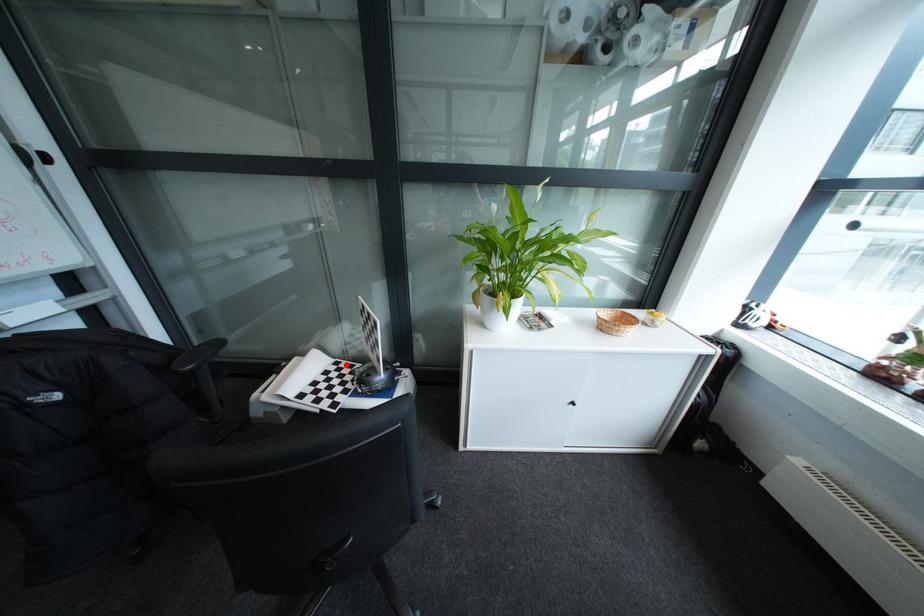
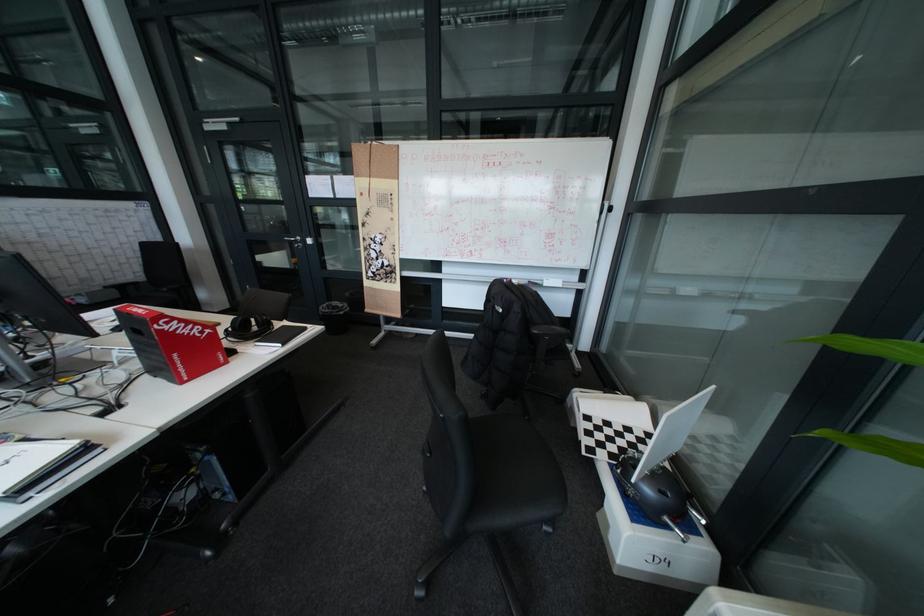
Locate, in the second image, the point that corresponds to the highlighted location in the first image.

(659, 432)